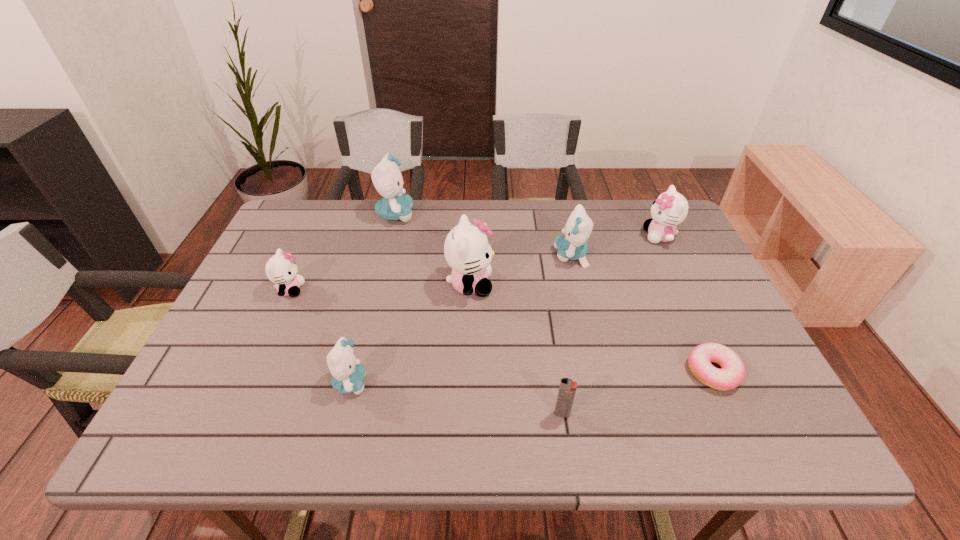
Image resolution: width=960 pixels, height=540 pixels. In order to click on the smallest blue kitten in this screenshot , I will do `click(347, 373)`.

You are a GUI agent. You are given a task and a screenshot of the screen. Output one action in this format:
    pyautogui.click(x=<x>, y=<y>)
    Task: Click on the fourth object from right to left
    The width and height of the screenshot is (960, 540).
    Given the screenshot: What is the action you would take?
    pyautogui.click(x=567, y=388)

Find the location of a particular element. This screenshot has height=540, width=960. the nearest object is located at coordinates (567, 388).

Find the location of a particular element. This screenshot has width=960, height=540. pink doughnut is located at coordinates (732, 374).

This screenshot has height=540, width=960. What are the coordinates of `doughnut` in the screenshot? It's located at (732, 374).

At what (x,y) coordinates should I click in order to perform the action: click on vacant space situated on the face of the farthest blue kitten. Please return your answer as a coordinate pair (x, y). The image size is (960, 540). Looking at the image, I should click on (436, 214).

The width and height of the screenshot is (960, 540). In order to click on free space located 0.290m on the front-facing side of the biggest white kitten in this screenshot , I will do `click(601, 285)`.

Find the location of a particular element. This screenshot has height=540, width=960. blank space located on the face of the rightmost blue kitten is located at coordinates (457, 255).

Locate an element on the screen. free spot located on the face of the rightmost blue kitten is located at coordinates (513, 255).

Where is `free location located on the face of the rightmost blue kitten`? Image resolution: width=960 pixels, height=540 pixels. free location located on the face of the rightmost blue kitten is located at coordinates (499, 255).